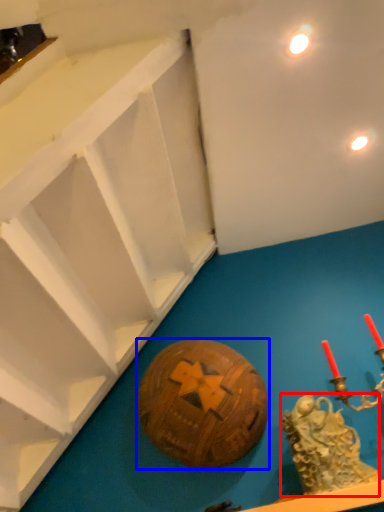
Question: Which object appears closest to the camera in this image, type (highlighted by a red box) or ball (highlighted by a blue box)?

Choices:
 (A) type
 (B) ball

Answer: (A)